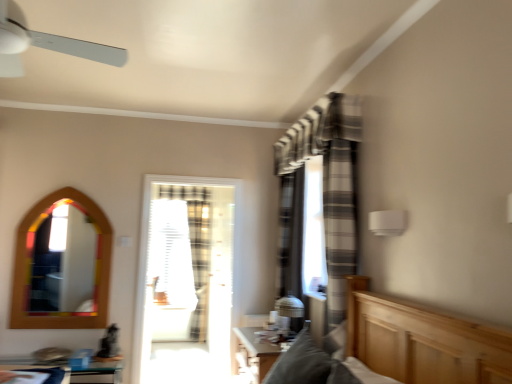
In order to face clear plastic screen at center, should I rotate leftwards or rightwards?

You should look left and rotate roughly 10.893 degrees.

What is the approximate width of wooden mirror at left?

The width of wooden mirror at left is 1.18 inches.

Find the location of `wooden table at lower center, the first table positioned from the right`. wooden table at lower center, the first table positioned from the right is located at coordinates (255, 353).

Find the location of a particular element. The width and height of the screenshot is (512, 384). gray striped curtain at center is located at coordinates (340, 198).

Choose the correct answer: Is wooden mirror at left inside clear glass table at lower left, positioned as the first table in left-to-right order, or outside it?

wooden mirror at left is not inside clear glass table at lower left, positioned as the first table in left-to-right order, it's outside.

Considering the sizes of objects wooden mirror at left and clear glass table at lower left, acting as the 2th table starting from the right, in the image provided, who is bigger, wooden mirror at left or clear glass table at lower left, acting as the 2th table starting from the right,?

clear glass table at lower left, acting as the 2th table starting from the right.

Considering the points (83, 224) and (118, 380), which point is in front, point (83, 224) or point (118, 380)?

Point (118, 380)

Does gray striped curtain at center turn towards wooden mirror at left?

No, gray striped curtain at center does not turn towards wooden mirror at left.

Does gray striped curtain at center have a smaller size compared to wooden mirror at left?

No.

This screenshot has width=512, height=384. Identify the location of curtain that is above the wooden mirror at left (from the image's perspective). (340, 198).

Between white plastic ceiling fan at upper left and wooden mirror at left, which one has smaller width?

Thinner between the two is wooden mirror at left.

In terms of size, does white plastic ceiling fan at upper left appear bigger or smaller than wooden mirror at left?

In the image, white plastic ceiling fan at upper left appears to be larger than wooden mirror at left.

Does point (105, 58) come behind point (62, 254)?

No, it is in front of (62, 254).

Is white plastic ceiling fan at upper left directly adjacent to wooden table at lower center, the first table positioned from the right?

No.

Would you say white plastic ceiling fan at upper left is to the left or to the right of wooden table at lower center, which is counted as the 2th table, starting from the left, in the picture?

white plastic ceiling fan at upper left is positioned on wooden table at lower center, which is counted as the 2th table, starting from the left,'s left side.

From a real-world perspective, which table is the 1st one underneath the white plastic ceiling fan at upper left? Please provide its 2D coordinates.

[(255, 353)]

Considering the positions of objects wooden table at lower center, which is counted as the 2th table, starting from the left, and gray striped curtain at center in the image provided, who is more to the right, wooden table at lower center, which is counted as the 2th table, starting from the left, or gray striped curtain at center?

gray striped curtain at center is more to the right.

Is wooden table at lower center, the first table positioned from the right, shorter than gray striped curtain at center?

Correct, wooden table at lower center, the first table positioned from the right, is not as tall as gray striped curtain at center.

Is point (259, 357) farther from viewer compared to point (334, 240)?

Yes, point (259, 357) is farther from viewer.

Between clear plastic screen at center and wooden mirror at left, which one has smaller width?

wooden mirror at left is thinner.

Locate an element on the screen. The width and height of the screenshot is (512, 384). window screen above the wooden mirror at left (from a real-world perspective) is located at coordinates 170,255.

Which is less distant, (154, 214) or (38, 286)?

Point (154, 214) is farther from the camera than point (38, 286).

Does clear plastic screen at center have a lesser height compared to wooden mirror at left?

No.

The image size is (512, 384). There is a translucent glass door at center. Find the location of `the 2nd table below it (from the image's perspective)`. the 2nd table below it (from the image's perspective) is located at coordinates (95, 369).

Who is taller, clear glass table at lower left, acting as the 2th table starting from the right, or translucent glass door at center?

translucent glass door at center.

Which object is closer to the camera taking this photo, clear glass table at lower left, acting as the 2th table starting from the right, or translucent glass door at center?

Positioned in front is clear glass table at lower left, acting as the 2th table starting from the right.

Between point (92, 362) and point (146, 298), which one is positioned behind?

The point (146, 298) is behind.

Locate an element on the screen. Image resolution: width=512 pixels, height=384 pixels. mirror on the left side of clear glass table at lower left, acting as the 2th table starting from the right is located at coordinates (63, 263).

The height and width of the screenshot is (384, 512). Find the location of `curtain positioned vertically above the wooden mirror at left (from a real-world perspective)`. curtain positioned vertically above the wooden mirror at left (from a real-world perspective) is located at coordinates (340, 198).

Estimate the real-world distances between objects in this image. Which object is closer to translucent glass door at center, clear glass table at lower left, acting as the 2th table starting from the right, or wooden table at lower center, the first table positioned from the right?

wooden table at lower center, the first table positioned from the right, is closer to translucent glass door at center.

When comparing their distances from wooden table at lower center, the first table positioned from the right, does clear glass table at lower left, acting as the 2th table starting from the right, or clear plastic screen at center seem closer?

The object closer to wooden table at lower center, the first table positioned from the right, is clear glass table at lower left, acting as the 2th table starting from the right.

When comparing their distances from clear glass table at lower left, positioned as the first table in left-to-right order, does translucent glass door at center or wooden mirror at left seem closer?

Among the two, wooden mirror at left is located nearer to clear glass table at lower left, positioned as the first table in left-to-right order.

From the image, which object appears to be farther from gray striped curtain at center, wooden table at lower center, the first table positioned from the right, or clear glass table at lower left, acting as the 2th table starting from the right?

Based on the image, clear glass table at lower left, acting as the 2th table starting from the right, appears to be further to gray striped curtain at center.

Looking at the image, which one is located closer to clear glass table at lower left, acting as the 2th table starting from the right, white plastic ceiling fan at upper left or translucent glass door at center?

translucent glass door at center is positioned closer to the anchor clear glass table at lower left, acting as the 2th table starting from the right.

Which object lies further to the anchor point translucent glass door at center, wooden table at lower center, which is counted as the 2th table, starting from the left, or gray striped curtain at center?

Among the two, gray striped curtain at center is located further to translucent glass door at center.

Which object lies nearer to the anchor point wooden table at lower center, which is counted as the 2th table, starting from the left, clear glass table at lower left, acting as the 2th table starting from the right, or white plastic ceiling fan at upper left?

Answer: The object closer to wooden table at lower center, which is counted as the 2th table, starting from the left, is clear glass table at lower left, acting as the 2th table starting from the right.

From the image, which object appears to be farther from gray striped curtain at center, wooden table at lower center, which is counted as the 2th table, starting from the left, or clear plastic screen at center?

The object further to gray striped curtain at center is clear plastic screen at center.

This screenshot has width=512, height=384. I want to click on table located between wooden mirror at left and translucent glass door at center in the left-right direction, so click(x=95, y=369).

Locate an element on the screen. This screenshot has height=384, width=512. curtain between white plastic ceiling fan at upper left and clear glass table at lower left, positioned as the first table in left-to-right order, in the up-down direction is located at coordinates (340, 198).

In order to click on curtain between white plastic ceiling fan at upper left and translucent glass door at center along the z-axis in this screenshot , I will do `click(340, 198)`.

Identify the location of table between wooden table at lower center, which is counted as the 2th table, starting from the left, and clear plastic screen at center, along the z-axis. (95, 369).